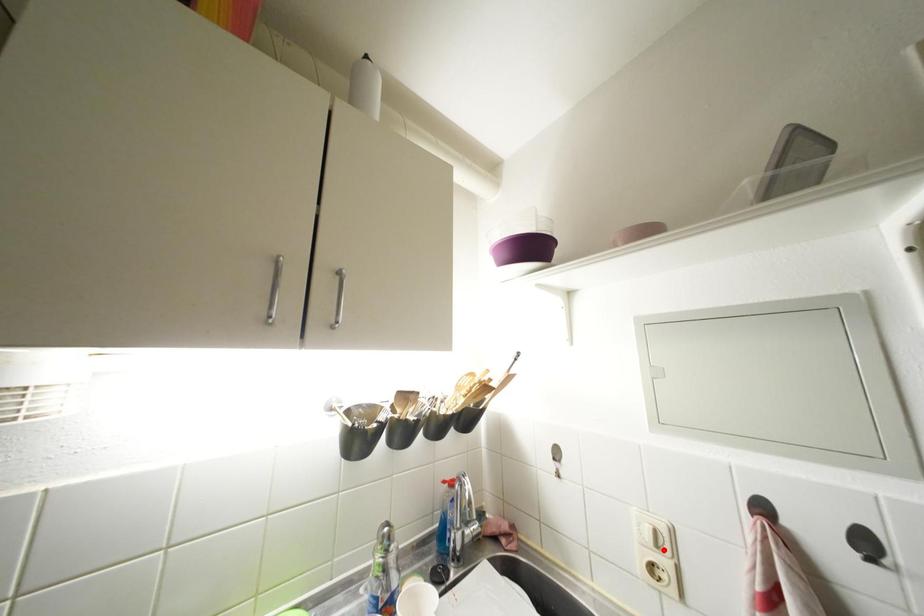
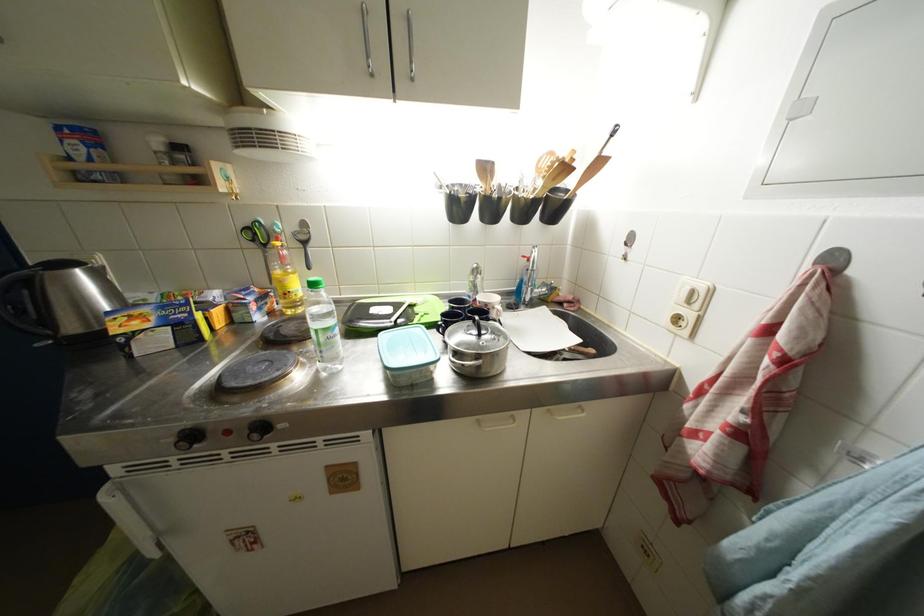
In the second image, find the point that corresponds to the highlighted location in the first image.

(696, 306)